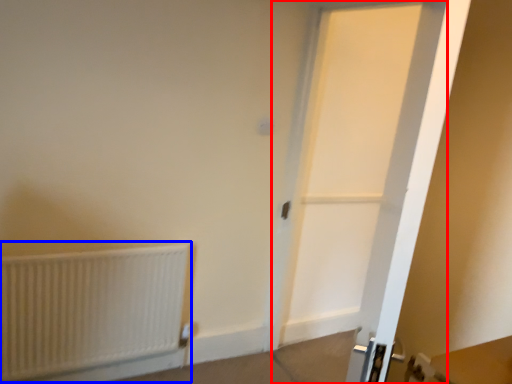
Question: Which object is further to the camera taking this photo, door (highlighted by a red box) or radiator (highlighted by a blue box)?

Choices:
 (A) door
 (B) radiator

Answer: (B)